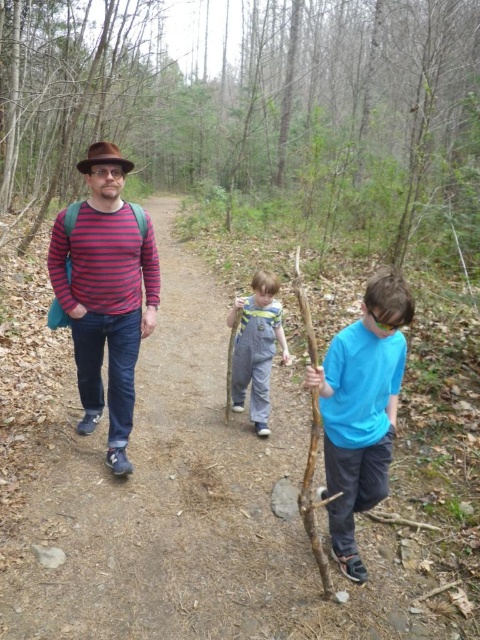
Can you confirm if blue cotton shirt at center is taller than denim overalls at center?

Yes, blue cotton shirt at center is taller than denim overalls at center.

Find the location of a particular element. The height and width of the screenshot is (640, 480). blue cotton shirt at center is located at coordinates (361, 410).

Consider the image. Is striped cotton shirt at center below denim overalls at center?

Actually, striped cotton shirt at center is above denim overalls at center.

Which is above, striped cotton shirt at center or denim overalls at center?

striped cotton shirt at center is higher up.

Identify the location of striped cotton shirt at center. This screenshot has height=640, width=480. (106, 292).

What do you see at coordinates (106, 292) in the screenshot?
I see `striped cotton shirt at center` at bounding box center [106, 292].

Measure the distance between striped cotton shirt at center and camera.

striped cotton shirt at center and camera are 9.50 feet apart.

You are a GUI agent. You are given a task and a screenshot of the screen. Output one action in this format:
    pyautogui.click(x=<x>, y=<y>)
    Task: Click on the striped cotton shirt at center
    
    Given the screenshot: What is the action you would take?
    pyautogui.click(x=106, y=292)